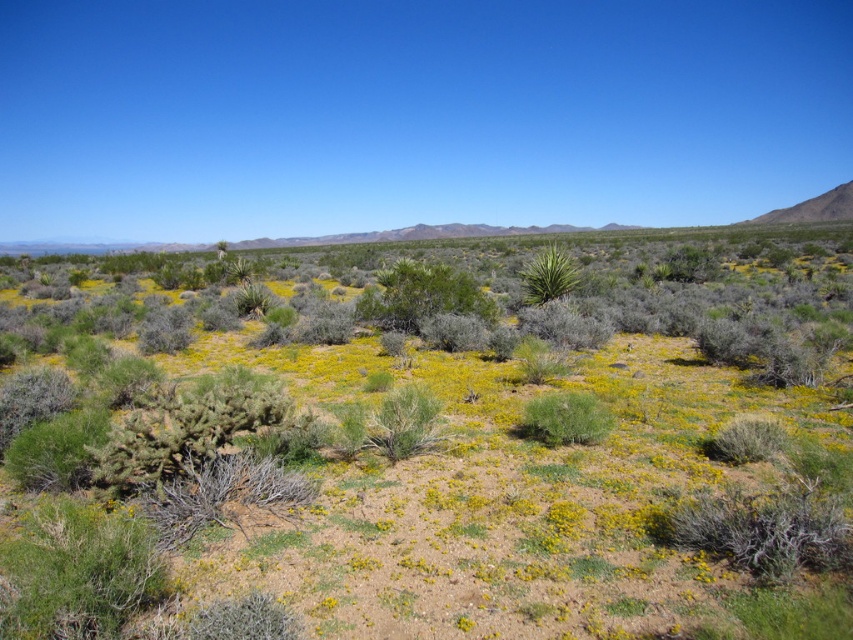
Question: Which of the following is the farthest from the observer?

Choices:
 (A) green spiky bush at center
 (B) green leafy bush at center

Answer: (A)

Question: Considering the relative positions of green leafy bush at center and green spiky bush at center in the image provided, where is green leafy bush at center located with respect to green spiky bush at center?

Choices:
 (A) above
 (B) below

Answer: (B)

Question: Is green shrubs at center smaller than green leafy bush at center?

Choices:
 (A) yes
 (B) no

Answer: (B)

Question: Which point is closer to the camera?

Choices:
 (A) green spiky bush at center
 (B) green shrubs at center

Answer: (B)

Question: Which of the following is the farthest from the observer?

Choices:
 (A) green leafy bush at center
 (B) green spiky bush at center

Answer: (B)

Question: Can you confirm if green shrubs at center is positioned to the right of green spiky bush at center?

Choices:
 (A) no
 (B) yes

Answer: (A)